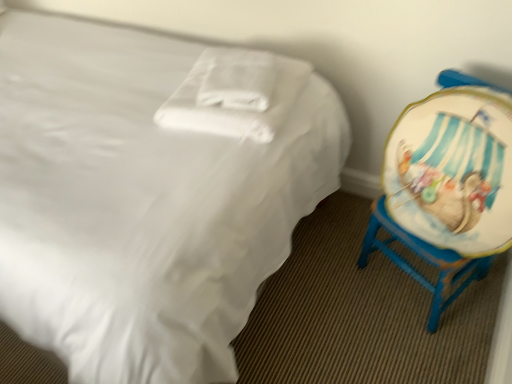
Question: Considering the relative positions of wooden painted chair at right and white soft pillow at center in the image provided, is wooden painted chair at right to the left or to the right of white soft pillow at center?

Choices:
 (A) right
 (B) left

Answer: (A)

Question: Is wooden painted chair at right inside the boundaries of white soft pillow at center, or outside?

Choices:
 (A) inside
 (B) outside

Answer: (B)

Question: Which object is the farthest from the white satin bed at center?

Choices:
 (A) wooden painted chair at right
 (B) white soft pillow at center

Answer: (A)

Question: Which of these objects is positioned farthest from the white satin bed at center?

Choices:
 (A) white soft pillow at center
 (B) wooden painted chair at right

Answer: (B)